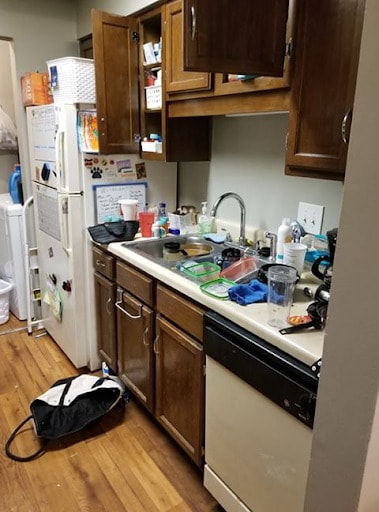
This screenshot has width=379, height=512. Find the location of `washer`. washer is located at coordinates (9, 238).